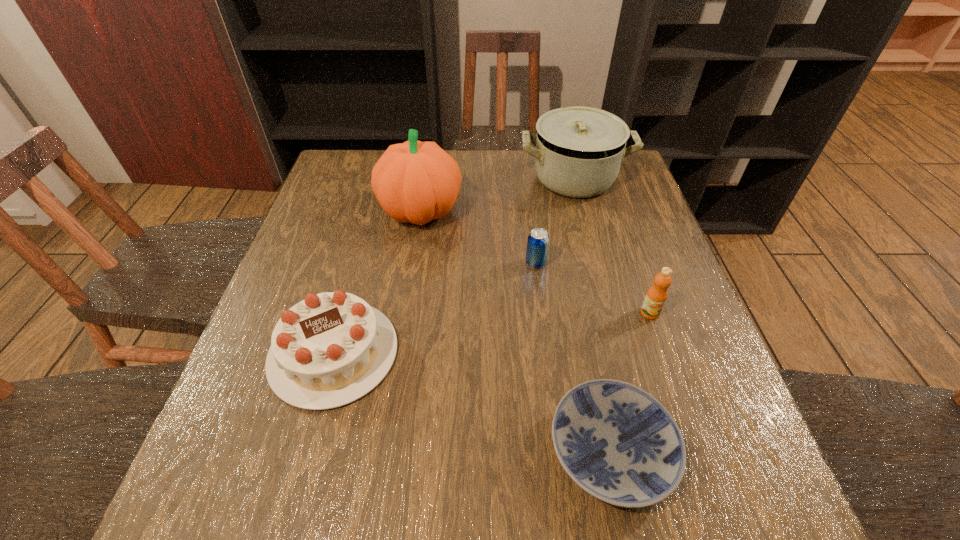
What are the coordinates of `free space between the fourth tallest object and the tallest object` in the screenshot? It's located at (377, 282).

The height and width of the screenshot is (540, 960). Identify the location of free space between the second shortest object and the shortest object. (573, 357).

The width and height of the screenshot is (960, 540). I want to click on free space that is in between the fifth tallest object and the third shortest object, so click(435, 308).

This screenshot has width=960, height=540. Identify the location of vacant area that lies between the fifth shortest object and the orange juice. (612, 245).

Locate an element on the screen. empty space between the fourth nearest object and the shortest object is located at coordinates (573, 357).

You are a GUI agent. You are given a task and a screenshot of the screen. Output one action in this format:
    pyautogui.click(x=<x>, y=<y>)
    Task: Click on the vacant region between the beer can and the shortest object
    This screenshot has height=540, width=960.
    Given the screenshot: What is the action you would take?
    pyautogui.click(x=573, y=357)

I want to click on free spot between the second tallest object and the tallest object, so click(x=497, y=194).

Where is `the fourth closest object to the birthday cake`? The height and width of the screenshot is (540, 960). the fourth closest object to the birthday cake is located at coordinates (578, 151).

Identify the location of object that is the third nearest to the second shortest object. (656, 296).

Where is `blank area in the image that satisfies the following two spatial constraints: 1. on the front side of the beer can; 2. on the right side of the shortest object`? The image size is (960, 540). blank area in the image that satisfies the following two spatial constraints: 1. on the front side of the beer can; 2. on the right side of the shortest object is located at coordinates (559, 450).